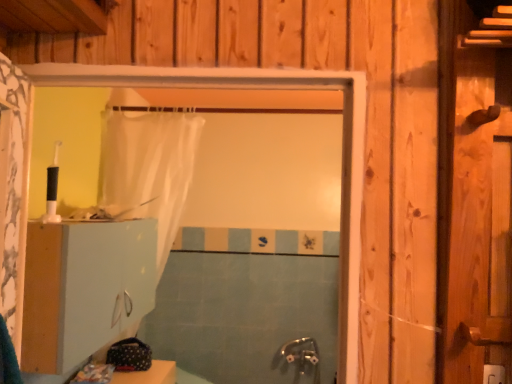
Question: Are translucent white shower curtain at center and white matte cabinet at lower left located far from each other?

Choices:
 (A) yes
 (B) no

Answer: (B)

Question: Is translucent white shower curtain at center closer to camera compared to white matte cabinet at lower left?

Choices:
 (A) no
 (B) yes

Answer: (A)

Question: From a real-world perspective, is translucent white shower curtain at center under white matte cabinet at lower left?

Choices:
 (A) no
 (B) yes

Answer: (A)

Question: Is translucent white shower curtain at center outside white matte cabinet at lower left?

Choices:
 (A) yes
 (B) no

Answer: (A)

Question: Considering the relative sizes of translucent white shower curtain at center and white matte cabinet at lower left in the image provided, is translucent white shower curtain at center shorter than white matte cabinet at lower left?

Choices:
 (A) yes
 (B) no

Answer: (B)

Question: From the image's perspective, is white matte cabinet at lower left positioned above or below translucent white shower curtain at center?

Choices:
 (A) below
 (B) above

Answer: (B)

Question: From their relative heights in the image, would you say white matte cabinet at lower left is taller or shorter than translucent white shower curtain at center?

Choices:
 (A) short
 (B) tall

Answer: (A)

Question: From a real-world perspective, is white matte cabinet at lower left positioned above or below translucent white shower curtain at center?

Choices:
 (A) below
 (B) above

Answer: (A)

Question: In terms of size, does white matte cabinet at lower left appear bigger or smaller than translucent white shower curtain at center?

Choices:
 (A) big
 (B) small

Answer: (B)

Question: In terms of width, does white matte cabinet at lower left look wider or thinner when compared to blue tile bath at center?

Choices:
 (A) wide
 (B) thin

Answer: (A)

Question: From the image's perspective, is white matte cabinet at lower left located above or below blue tile bath at center?

Choices:
 (A) above
 (B) below

Answer: (A)

Question: From a real-world perspective, is white matte cabinet at lower left physically located above or below blue tile bath at center?

Choices:
 (A) below
 (B) above

Answer: (B)

Question: Relative to blue tile bath at center, is white matte cabinet at lower left in front or behind?

Choices:
 (A) behind
 (B) front

Answer: (B)

Question: From a real-world perspective, relative to blue tile bath at center, is translucent white shower curtain at center vertically above or below?

Choices:
 (A) below
 (B) above

Answer: (B)

Question: From the image's perspective, is translucent white shower curtain at center positioned above or below blue tile bath at center?

Choices:
 (A) below
 (B) above

Answer: (B)